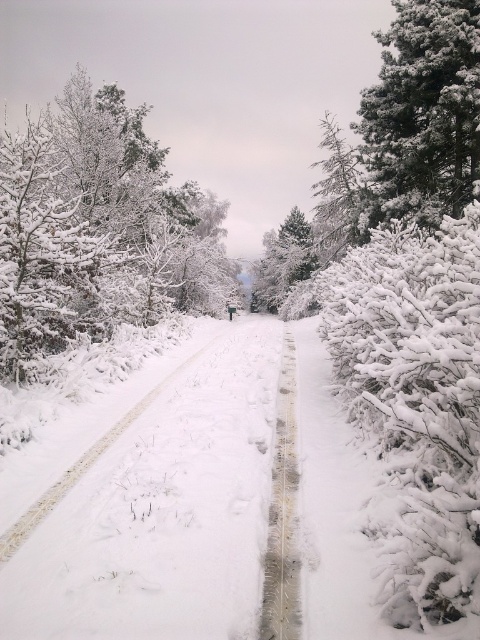
Does white frosty tree at left appear over green textured pine at center?

Yes.

Image resolution: width=480 pixels, height=640 pixels. Find the location of `white frosty tree at left`. white frosty tree at left is located at coordinates (96, 230).

You are a GUI agent. You are given a task and a screenshot of the screen. Output one action in this format:
    pyautogui.click(x=<x>, y=<y>)
    Task: Click on the white frosty tree at left
    This screenshot has height=640, width=480.
    Given the screenshot: What is the action you would take?
    pyautogui.click(x=96, y=230)

Does white frosty tree at left come behind white snow-covered tree at upper right?

No, it is not.

Can you confirm if white frosty tree at left is shorter than white snow-covered tree at upper right?

No.

Which is behind, point (203, 292) or point (472, 164)?

Point (203, 292)

You are a GUI agent. You are given a task and a screenshot of the screen. Output one action in this format:
    pyautogui.click(x=<x>, y=<y>)
    Task: Click on the white frosty tree at left
    The image size is (480, 640).
    Given the screenshot: What is the action you would take?
    pyautogui.click(x=96, y=230)

Who is higher up, white snow-covered tree at upper right or green textured pine at center?

white snow-covered tree at upper right

Can you confirm if white snow-covered tree at upper right is bigger than green textured pine at center?

Incorrect, white snow-covered tree at upper right is not larger than green textured pine at center.

I want to click on white snow-covered tree at upper right, so click(423, 112).